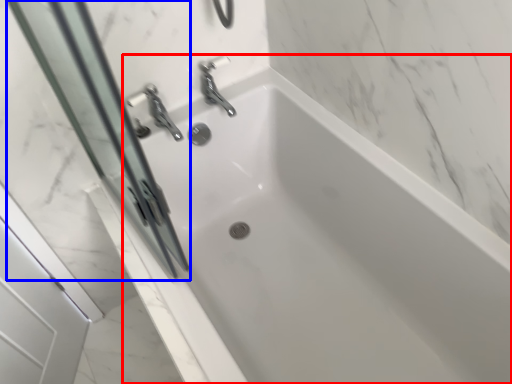
Question: Which object is further to the camera taking this photo, bathtub (highlighted by a red box) or screen door (highlighted by a blue box)?

Choices:
 (A) bathtub
 (B) screen door

Answer: (A)